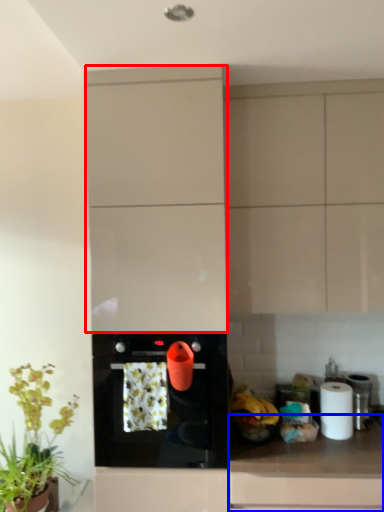
Question: Which point is closer to the camera, cabinetry (highlighted by a red box) or countertop (highlighted by a blue box)?

Choices:
 (A) cabinetry
 (B) countertop

Answer: (B)